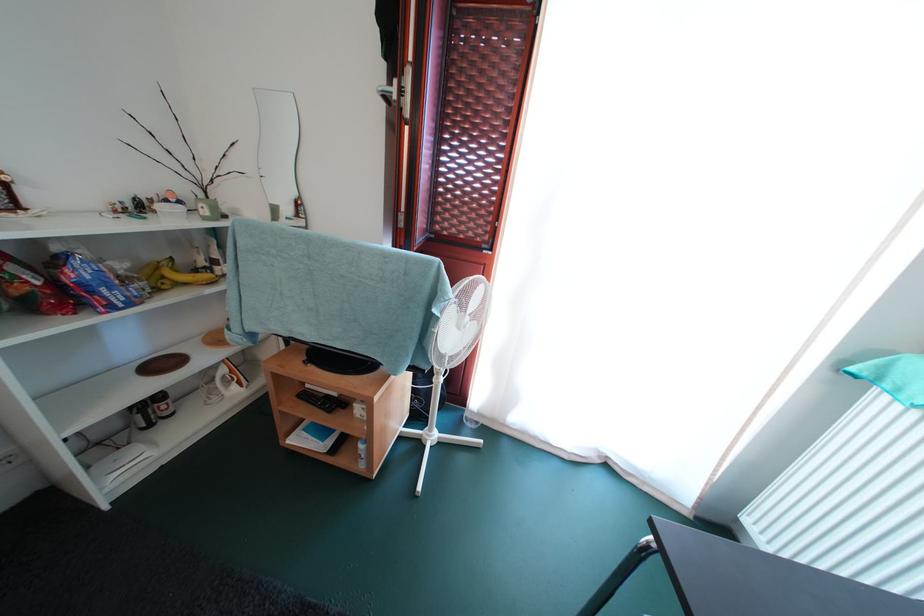
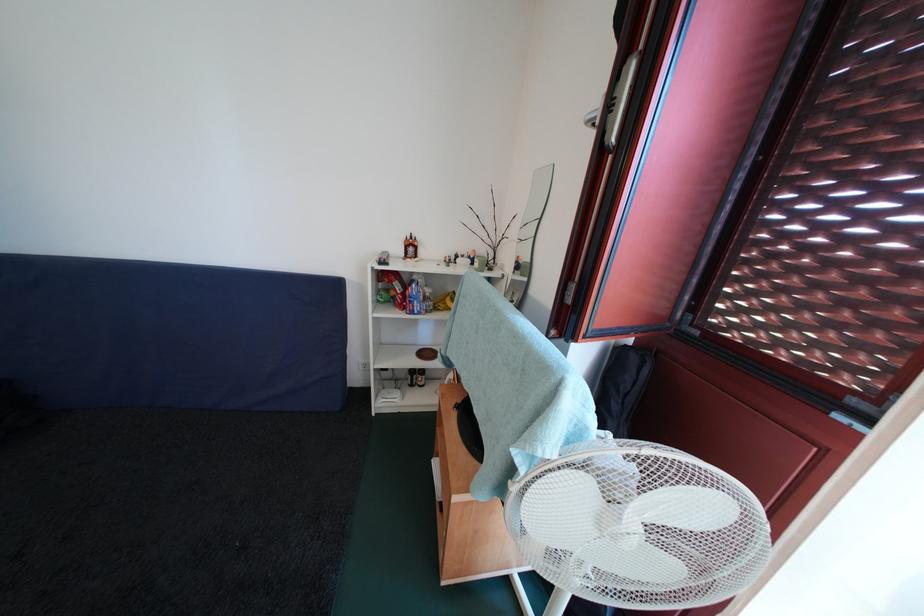
Question: The images are taken continuously from a first-person perspective. In which direction is your viewpoint rotating?

Choices:
 (A) Left
 (B) Right
 (C) Up
 (D) Down

Answer: (A)